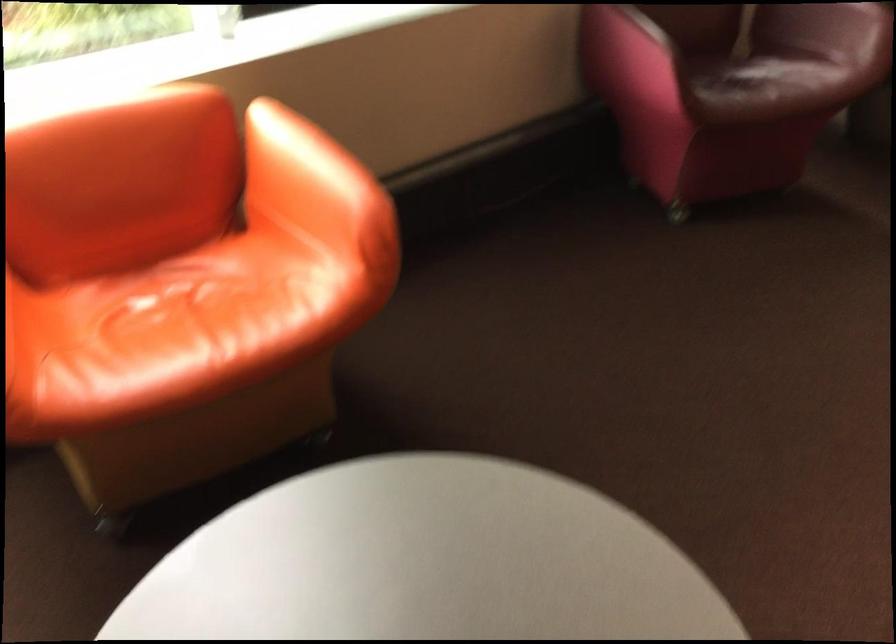
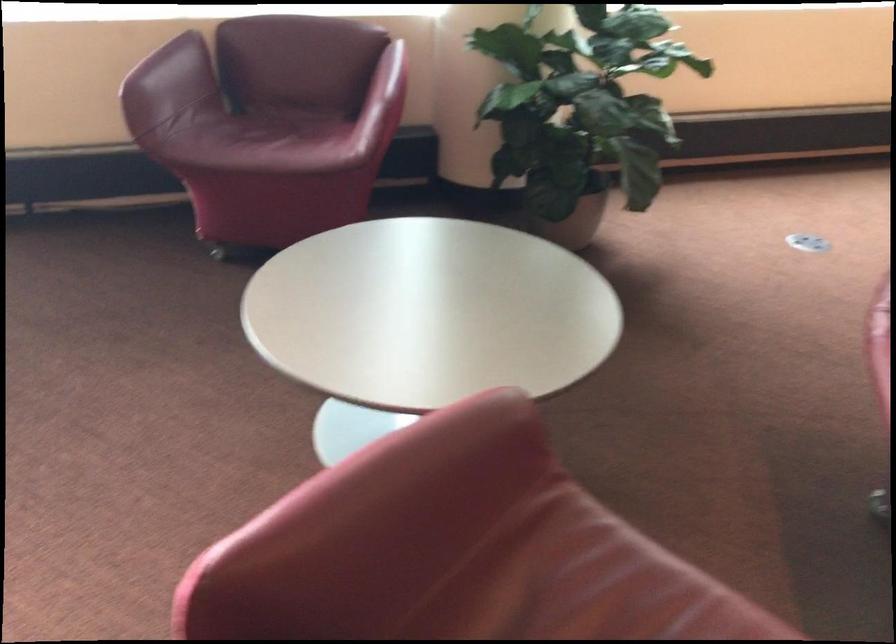
Question: The images are taken continuously from a first-person perspective. In which direction are you moving?

Choices:
 (A) Left
 (B) Right
 (C) Forward
 (D) Backward

Answer: (B)